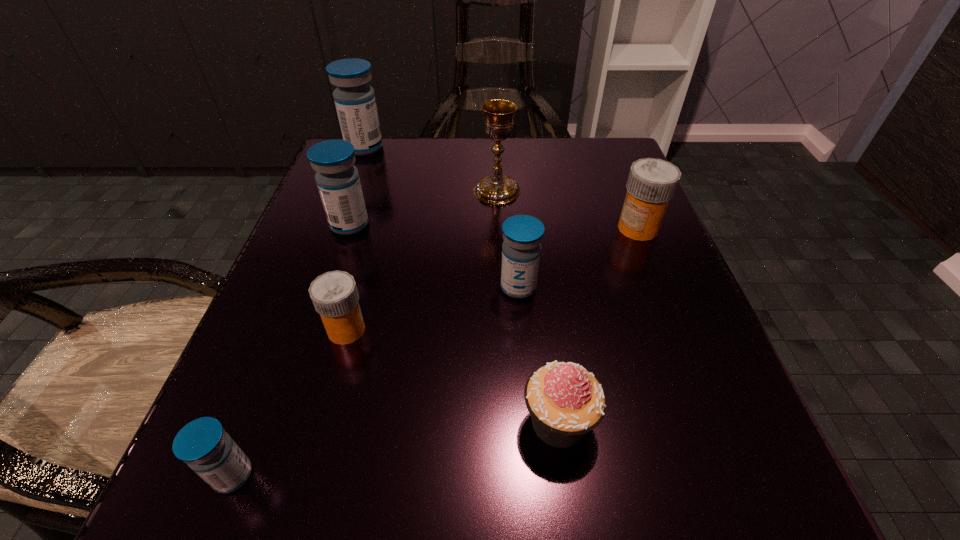
The width and height of the screenshot is (960, 540). In order to click on object that is at the near left corner in this screenshot , I will do `click(203, 444)`.

Image resolution: width=960 pixels, height=540 pixels. Find the location of `vacant space at the far edge of the desktop`. vacant space at the far edge of the desktop is located at coordinates (406, 181).

Locate an element on the screen. vacant space at the near edge of the desktop is located at coordinates (602, 484).

You are a GUI agent. You are given a task and a screenshot of the screen. Output one action in this format:
    pyautogui.click(x=<x>, y=<y>)
    Task: Click on the vacant space at the left edge of the desktop
    The height and width of the screenshot is (540, 960).
    Given the screenshot: What is the action you would take?
    pyautogui.click(x=307, y=366)

In the image, there is a desktop. At what (x,y) coordinates should I click in order to perform the action: click on vacant space at the right edge. Please return your answer as a coordinate pair (x, y). The height and width of the screenshot is (540, 960). Looking at the image, I should click on (608, 373).

What are the coordinates of `free region at the far left corner` in the screenshot? It's located at (392, 169).

The image size is (960, 540). In the image, there is a desktop. Identify the location of vacant space at the near left corner. (312, 529).

Locate an element on the screen. This screenshot has width=960, height=540. vacant area at the far right corner of the desktop is located at coordinates (585, 174).

Where is `vacant area that lies between the second medicine from right to left and the sixth shortest object`? This screenshot has height=540, width=960. vacant area that lies between the second medicine from right to left and the sixth shortest object is located at coordinates (434, 256).

The image size is (960, 540). In order to click on free space that is in between the fifth shortest medicine and the second nearest blue medicine in this screenshot , I will do `click(434, 256)`.